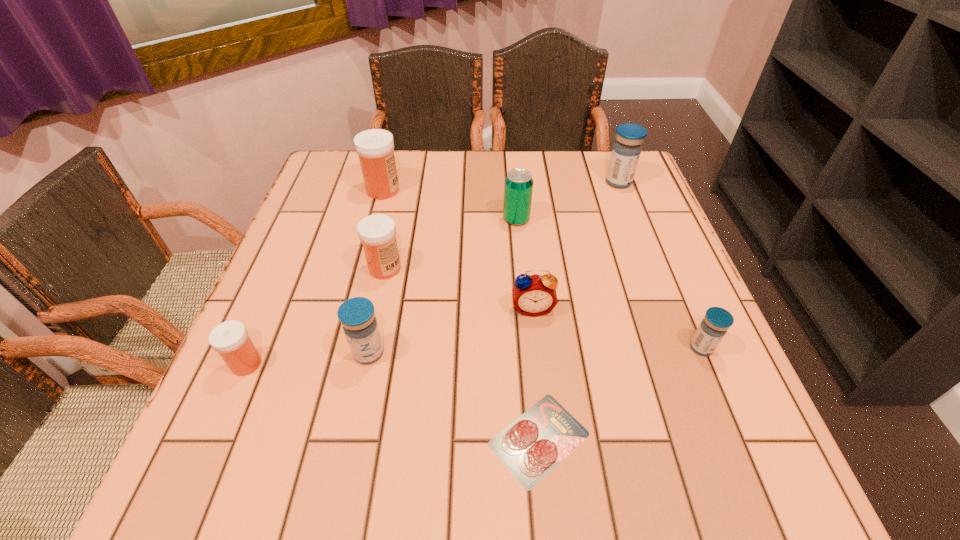
The height and width of the screenshot is (540, 960). I want to click on the farthest blue medicine, so click(626, 151).

You are a GUI agent. You are given a task and a screenshot of the screen. Output one action in this format:
    pyautogui.click(x=<x>, y=<y>)
    Task: Click on the biggest white medicine
    
    Given the screenshot: What is the action you would take?
    pyautogui.click(x=375, y=147)

I want to click on teal beer can, so click(518, 187).

At what (x,y) coordinates should I click in order to perform the action: click on the seventh nearest object. Please return your answer as a coordinate pair (x, y). The width and height of the screenshot is (960, 540). Looking at the image, I should click on (518, 187).

Locate an element on the screen. The width and height of the screenshot is (960, 540). the leftmost blue medicine is located at coordinates (357, 316).

Locate an element on the screen. This screenshot has height=540, width=960. the fourth farthest object is located at coordinates (377, 232).

Identify the location of the second smallest white medicine. point(377,232).

Locate an element on the screen. The width and height of the screenshot is (960, 540). alarm clock is located at coordinates (535, 295).

What are the coordinates of `red alarm clock` in the screenshot? It's located at (535, 295).

Where is `the smallest blue medicine`? Image resolution: width=960 pixels, height=540 pixels. the smallest blue medicine is located at coordinates (716, 322).